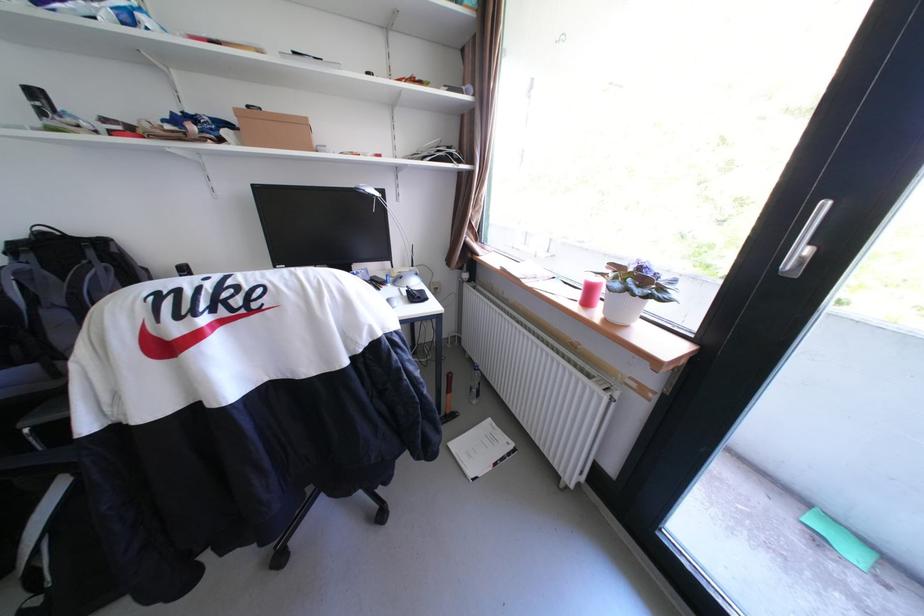
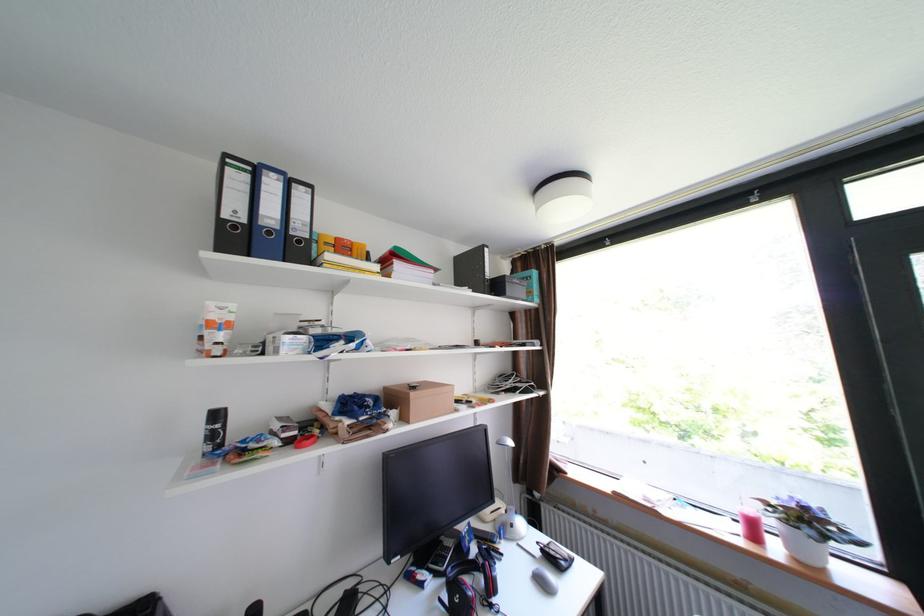
In the second image, find the point that corresponds to [418,291] in the first image.

(553, 551)